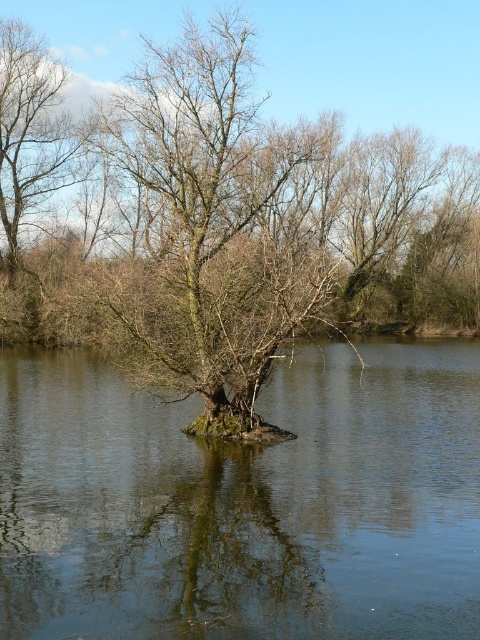
From the picture: Is greenish-brown mud at center taller than green leafy tree at center?

In fact, greenish-brown mud at center may be shorter than green leafy tree at center.

Does greenish-brown mud at center have a lesser width compared to green leafy tree at center?

Yes.

Does point (11, 618) come in front of point (373, 97)?

Yes, point (11, 618) is closer to viewer.

Where is `greenish-brown mud at center`? greenish-brown mud at center is located at coordinates (243, 502).

Can you confirm if greenish-brown mud at center is thinner than greenish reflective water at center?

No, greenish-brown mud at center is not thinner than greenish reflective water at center.

Who is shorter, greenish-brown mud at center or greenish reflective water at center?

greenish reflective water at center

Between point (64, 480) and point (175, 598), which one is positioned behind?

Positioned behind is point (64, 480).

The image size is (480, 640). I want to click on greenish-brown mud at center, so click(x=243, y=502).

Between green leafy tree at center and greenish reflective water at center, which one has less height?

With less height is greenish reflective water at center.

Does point (362, 56) come closer to viewer compared to point (253, 588)?

No, it is not.

The width and height of the screenshot is (480, 640). Describe the element at coordinates (296, 54) in the screenshot. I see `green leafy tree at center` at that location.

Identify the location of green leafy tree at center. (296, 54).